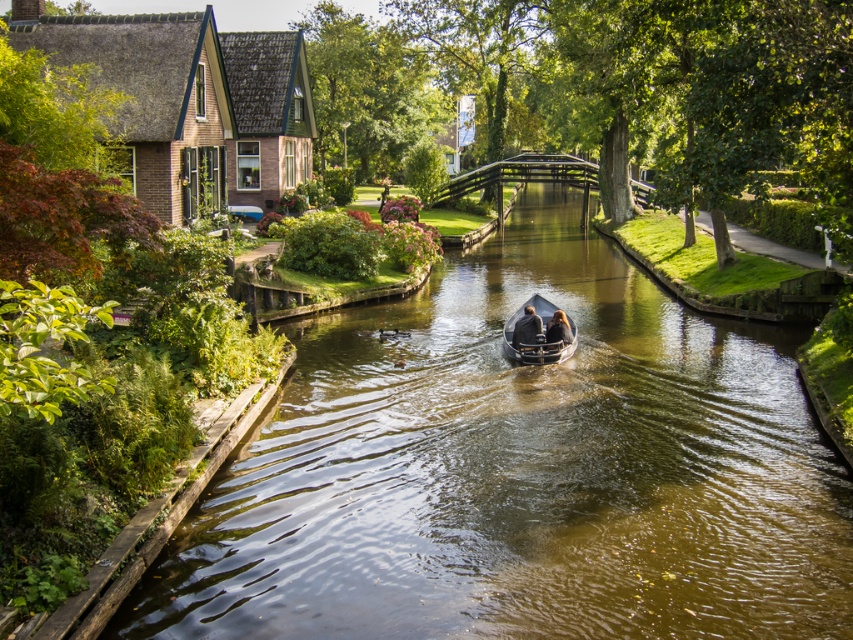
Question: Which of these objects is positioned farthest from the smooth brown hair at center?

Choices:
 (A) metallic gray boat at center
 (B) smooth black boat at center
 (C) green smooth water at center

Answer: (C)

Question: Does green smooth water at center appear under metallic gray boat at center?

Choices:
 (A) no
 (B) yes

Answer: (B)

Question: Is green smooth water at center to the left of smooth brown hair at center from the viewer's perspective?

Choices:
 (A) no
 (B) yes

Answer: (B)

Question: Can you confirm if metallic gray boat at center is positioned below smooth black boat at center?

Choices:
 (A) yes
 (B) no

Answer: (A)

Question: Among these objects, which one is farthest from the camera?

Choices:
 (A) smooth black boat at center
 (B) metallic gray boat at center
 (C) smooth brown hair at center

Answer: (C)

Question: Among these objects, which one is farthest from the camera?

Choices:
 (A) smooth black boat at center
 (B) smooth brown hair at center
 (C) green smooth water at center

Answer: (B)